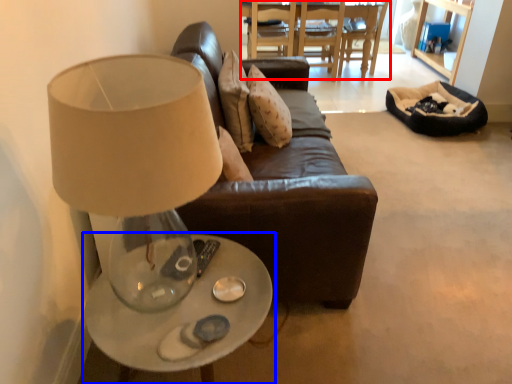
Question: Which object appears closest to the camera in this image, table (highlighted by a red box) or table (highlighted by a blue box)?

Choices:
 (A) table
 (B) table

Answer: (B)